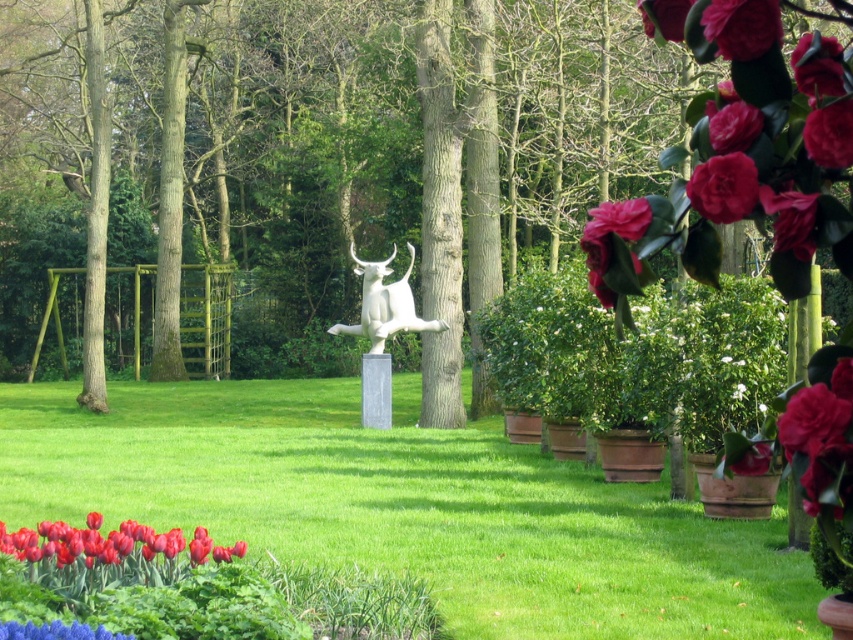
Question: Which object is closer to the camera taking this photo?

Choices:
 (A) white glossy bull at center
 (B) smooth glossy tulip at lower left
 (C) green grass at center
 (D) green matte tree at center

Answer: (D)

Question: Considering the real-world distances, which object is farthest from the green matte tree at center?

Choices:
 (A) green grass at center
 (B) smooth glossy tulip at lower left

Answer: (B)

Question: Can you confirm if smooth glossy tulip at lower left is positioned above white glossy bull at center?

Choices:
 (A) yes
 (B) no

Answer: (B)

Question: Is green matte tree at center to the right of white glossy bull at center from the viewer's perspective?

Choices:
 (A) yes
 (B) no

Answer: (B)

Question: Is smooth glossy tulip at lower left positioned before white glossy bull at center?

Choices:
 (A) no
 (B) yes

Answer: (B)

Question: Which of the following is the closest to the observer?

Choices:
 (A) smooth glossy tulip at lower left
 (B) white glossy bull at center
 (C) green matte tree at center

Answer: (C)